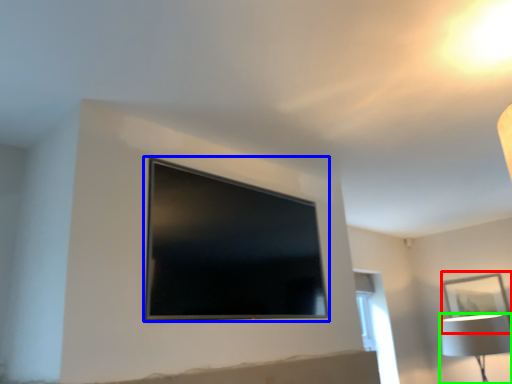
Question: Which object is positioned farthest from picture frame (highlighted by a red box)? Select from television (highlighted by a blue box) and lamp (highlighted by a green box).

Choices:
 (A) television
 (B) lamp

Answer: (A)